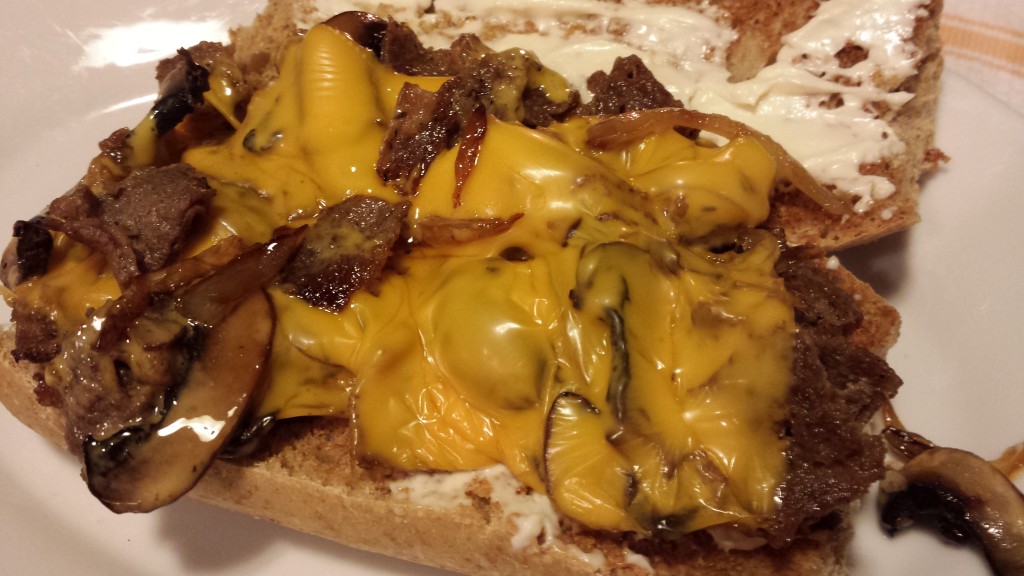
Where is `mushroom on plate`? The height and width of the screenshot is (576, 1024). mushroom on plate is located at coordinates (948, 472).